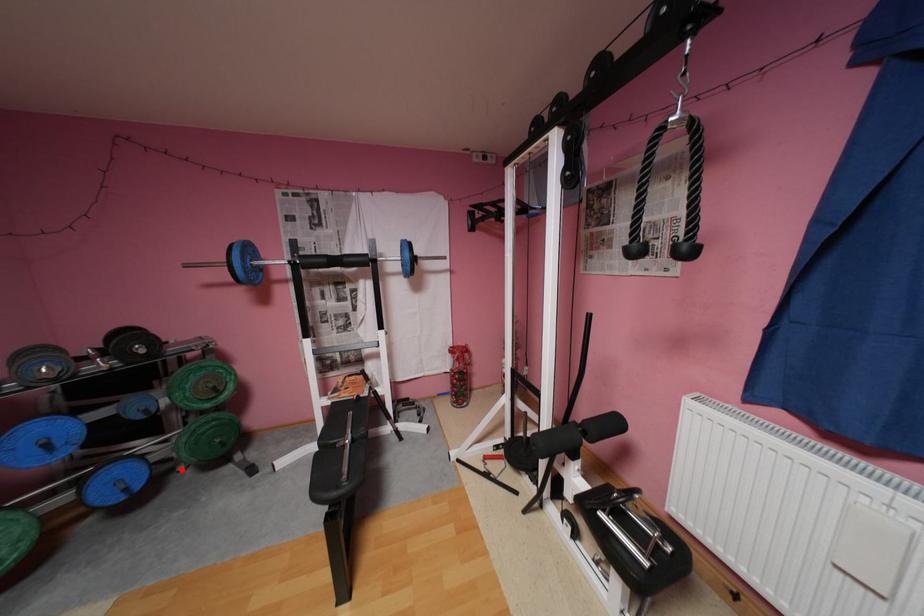
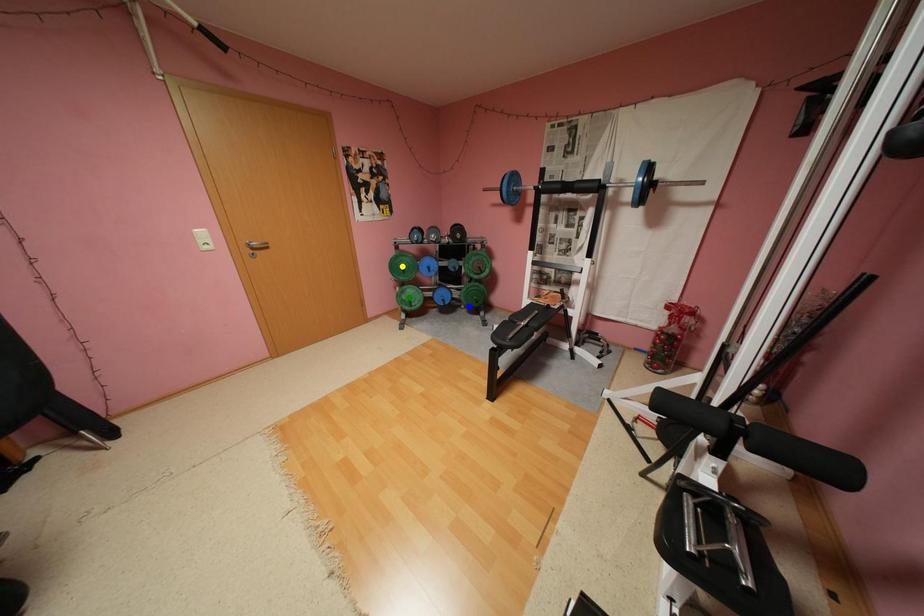
Question: I am providing you with two images of the same scene from different viewpoints. A red point is marked on the first image. You are given multiple points on the second image. Which point in image 2 is actually the same real-world point as the red point in image 1?

Choices:
 (A) blue point
 (B) yellow point
 (C) green point

Answer: (A)